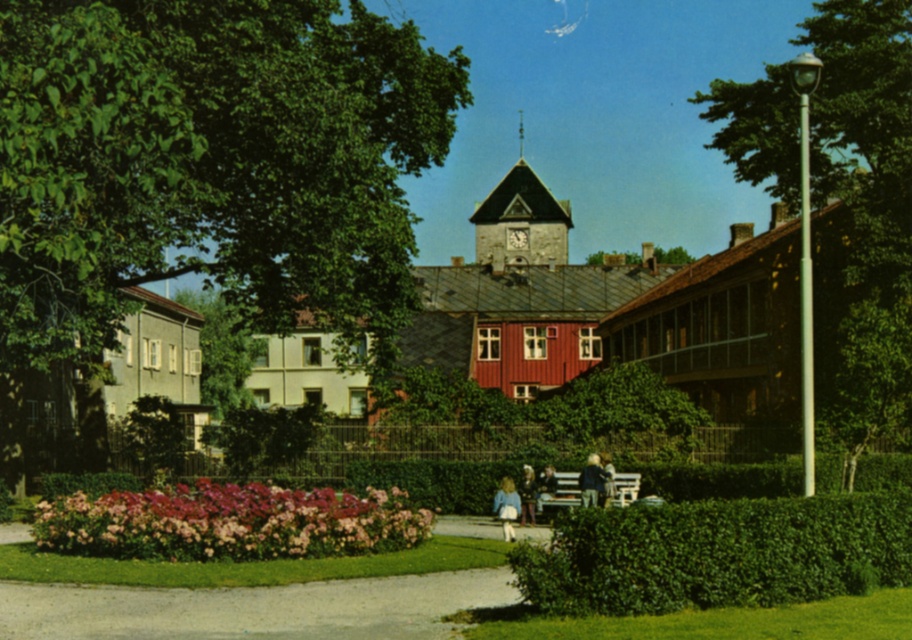
You are a landscape architect designing a garden path. You have two hedges, the green leafy hedge at lower center and the pink textured hedge at lower center. Which hedge would you choose if you want to create a more prominent boundary along the path?

The green leafy hedge at lower center is larger in size than the pink textured hedge at lower center, so it would create a more prominent boundary along the path.

You are a landscape architect designing a new garden. You want to place a tall sculpture between the green leafy tree at right and the green leafy hedge at lower center. Which object should the sculpture be placed closer to so it doesn

The green leafy tree at right is taller than the green leafy hedge at lower center, so the sculpture should be placed closer to the green leafy tree at right to maintain visual balance.